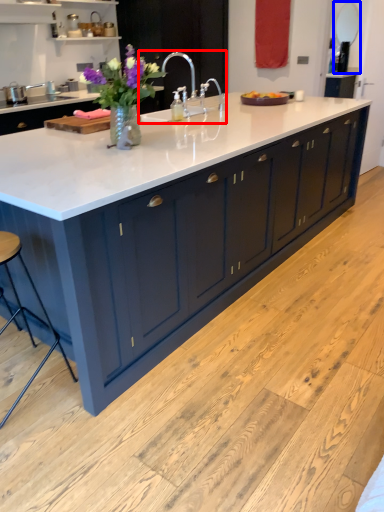
Question: Which object appears closest to the camera in this image, sink (highlighted by a red box) or mirror (highlighted by a blue box)?

Choices:
 (A) sink
 (B) mirror

Answer: (A)